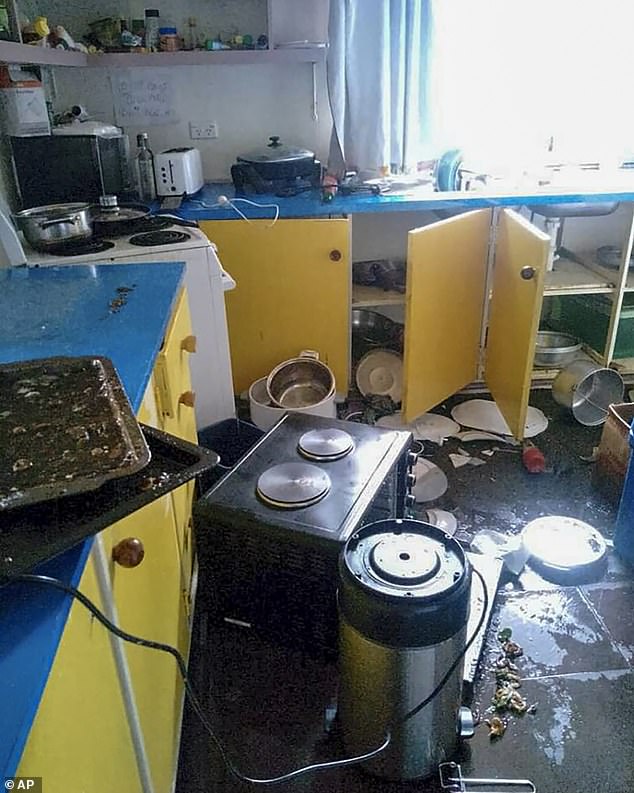
You are a GUI agent. You are given a task and a screenshot of the screen. Output one action in this format:
    pyautogui.click(x=<x>, y=<y>)
    Task: Click on the plates
    The height and width of the screenshot is (793, 634).
    Given the screenshot: What is the action you would take?
    pyautogui.click(x=440, y=476), pyautogui.click(x=443, y=515), pyautogui.click(x=495, y=420), pyautogui.click(x=440, y=430)